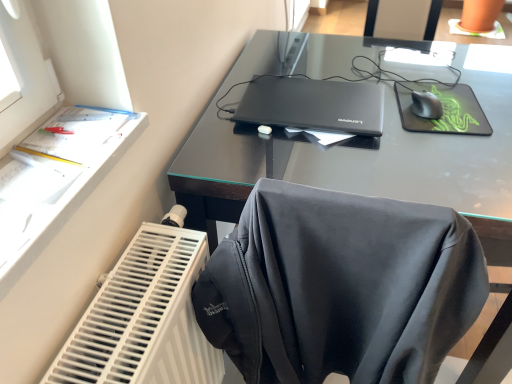
Image resolution: width=512 pixels, height=384 pixels. Identify the location of free space between black matte laptop at center and green matte mousepad at upper right. (401, 113).